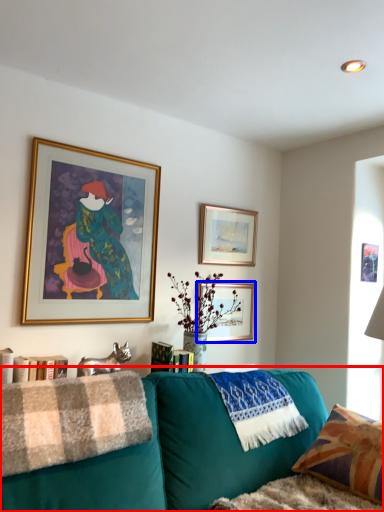
Question: Which object appears closest to the camera in this image, studio couch (highlighted by a red box) or picture frame (highlighted by a blue box)?

Choices:
 (A) studio couch
 (B) picture frame

Answer: (A)